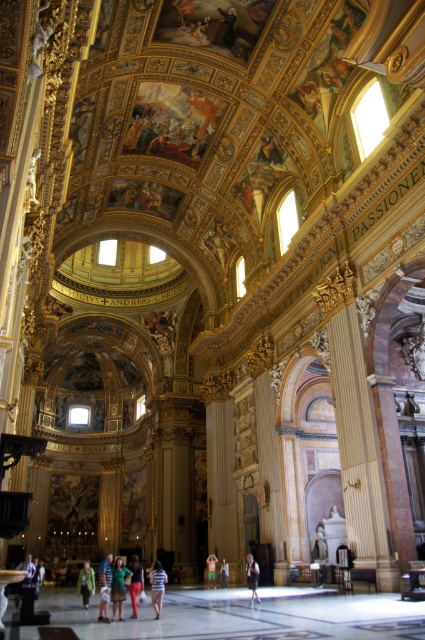
Is light brown leather jacket at center smaller than light blue denim jeans at center?

Actually, light brown leather jacket at center might be larger than light blue denim jeans at center.

Between light brown leather jacket at center and light blue denim jeans at center, which one is positioned lower?

light blue denim jeans at center

Between point (251, 604) and point (226, 572), which one is positioned behind?

The point (226, 572) is more distant.

This screenshot has width=425, height=640. In order to click on light brown leather jacket at center in this screenshot , I will do `click(252, 577)`.

Does light brown leather jacket at center have a greater height compared to orange cotton shirt at center?

Yes.

Is light brown leather jacket at center positioned at the back of orange cotton shirt at center?

No, light brown leather jacket at center is in front of orange cotton shirt at center.

Is point (254, 566) less distant than point (210, 579)?

Yes, it is.

You are a GUI agent. You are given a task and a screenshot of the screen. Output one action in this format:
    pyautogui.click(x=<x>, y=<y>)
    Task: Click on the light brown leather jacket at center
    The image size is (425, 640).
    Given the screenshot: What is the action you would take?
    pyautogui.click(x=252, y=577)

Does striped fabric person at center appear over white cotton shirt at lower left?

Incorrect, striped fabric person at center is not positioned above white cotton shirt at lower left.

Which of these two, striped fabric person at center or white cotton shirt at lower left, stands shorter?

Standing shorter between the two is white cotton shirt at lower left.

The image size is (425, 640). Identify the location of striped fabric person at center. (156, 586).

Find the location of a particular element. The height and width of the screenshot is (640, 425). striped fabric person at center is located at coordinates (156, 586).